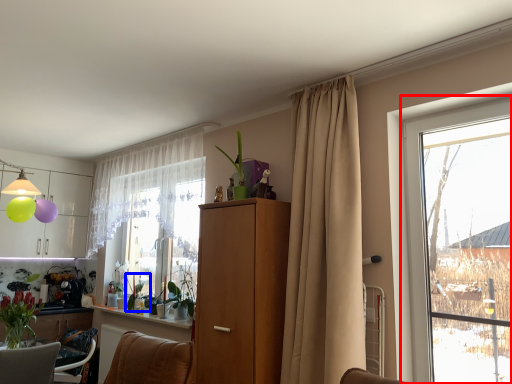
Question: Which object is closer to the camera taking this photo, window (highlighted by a red box) or plant (highlighted by a blue box)?

Choices:
 (A) window
 (B) plant

Answer: (A)